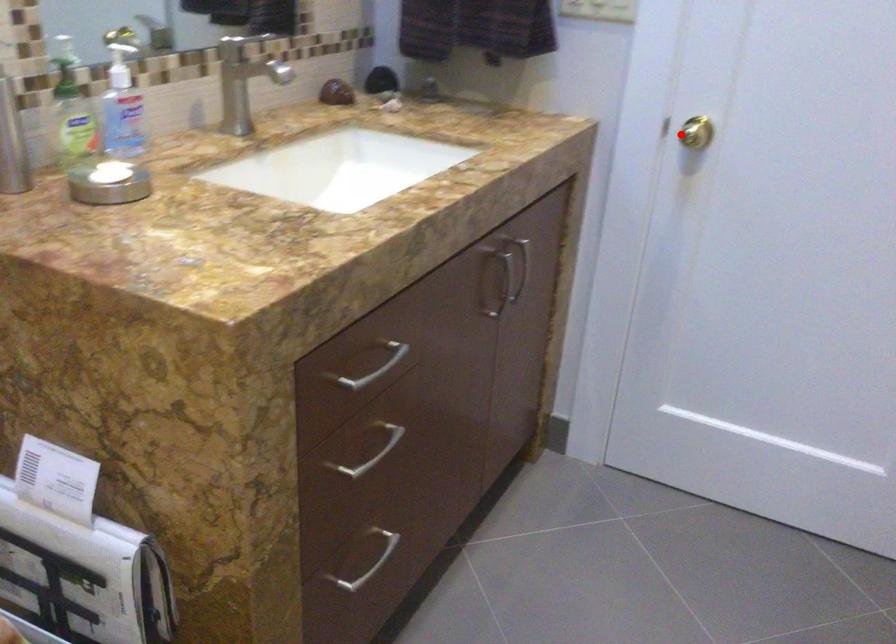
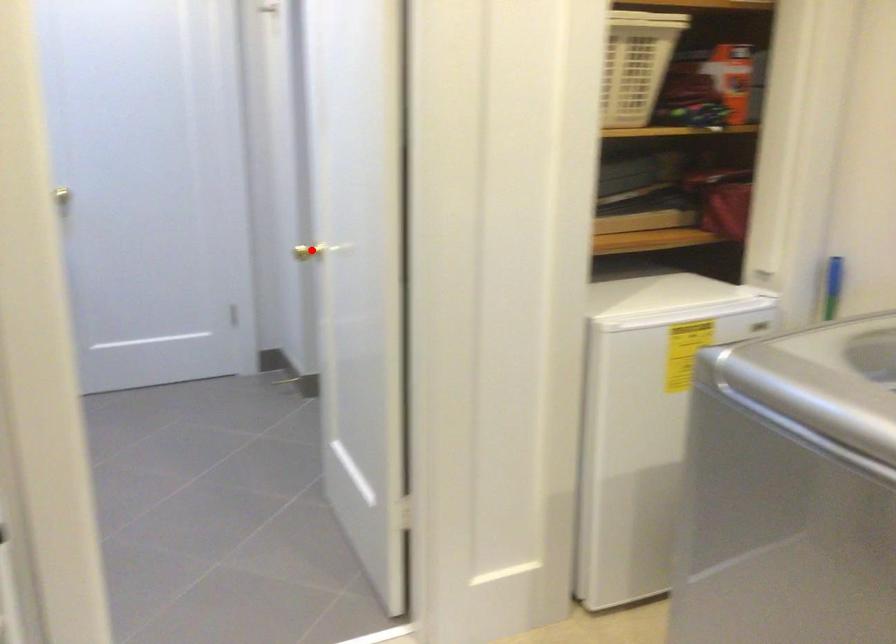
I am providing you with two images of the same scene from different viewpoints. A red point is marked on the first image and another point is marked on the second image. Is the red point in image1 aligned with the point shown in image2?

No